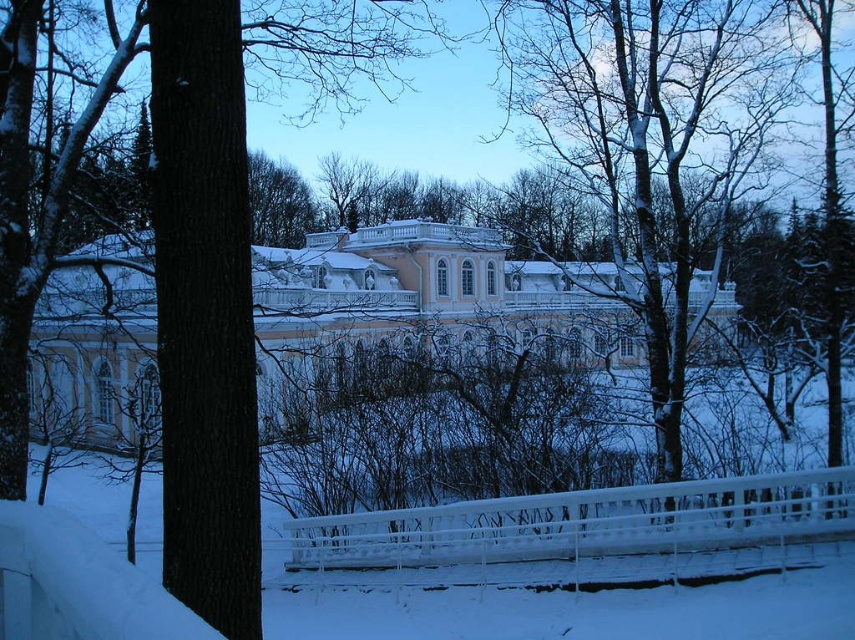
You are standing at the point marked by the coordinates point [423,298] in the winter scene. What structure are you directly facing?

You are directly facing the white glossy palace at center, as the coordinates point [423,298] represent its location.

You are standing at the entrance of the white glossy palace at center and want to reach the smooth bark tree at center. Which direction should you walk to get closer to the tree without going through the palace?

The smooth bark tree at center is behind the white glossy palace at center, so you should walk backward away from the entrance to reach the tree without going through the palace.